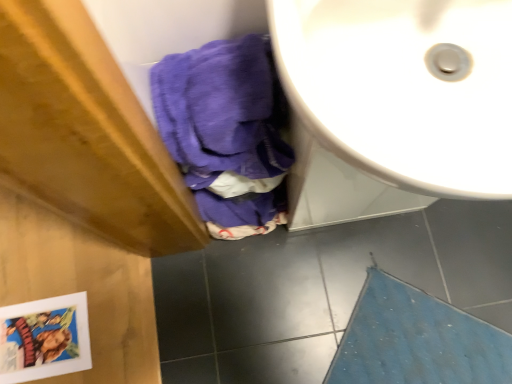
Question: Would you say blue textured bath mat at lower right is to the left or to the right of white glossy sink at upper right in the picture?

Choices:
 (A) left
 (B) right

Answer: (B)

Question: Is blue textured bath mat at lower right situated inside white glossy sink at upper right or outside?

Choices:
 (A) inside
 (B) outside

Answer: (B)

Question: From their relative heights in the image, would you say blue textured bath mat at lower right is taller or shorter than white glossy sink at upper right?

Choices:
 (A) short
 (B) tall

Answer: (A)

Question: Relative to blue textured bath mat at lower right, is white glossy sink at upper right in front or behind?

Choices:
 (A) front
 (B) behind

Answer: (A)

Question: Considering the positions of white glossy sink at upper right and blue textured bath mat at lower right in the image, is white glossy sink at upper right taller or shorter than blue textured bath mat at lower right?

Choices:
 (A) tall
 (B) short

Answer: (A)

Question: From a real-world perspective, is white glossy sink at upper right positioned above or below blue textured bath mat at lower right?

Choices:
 (A) above
 (B) below

Answer: (A)

Question: In the image, is white glossy sink at upper right on the left side or the right side of blue textured bath mat at lower right?

Choices:
 (A) left
 (B) right

Answer: (A)